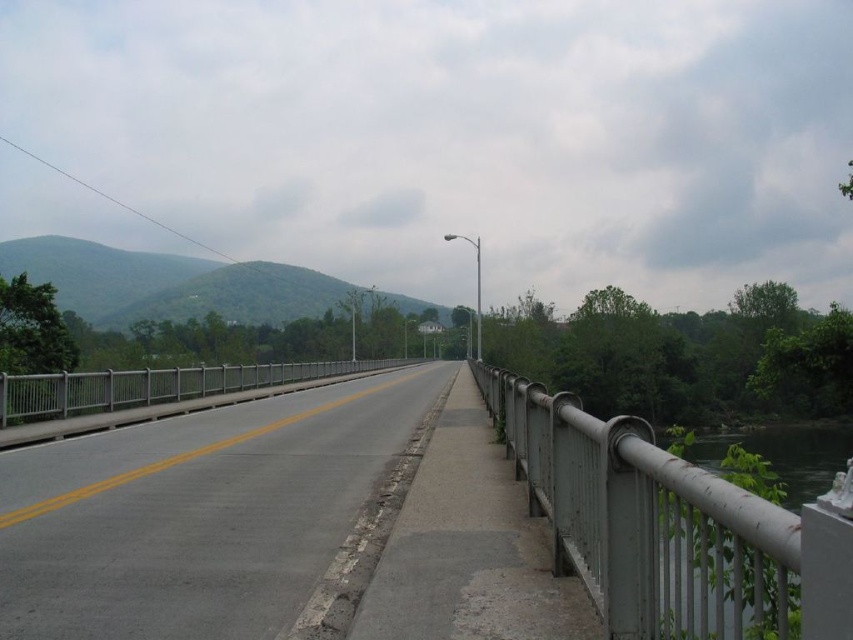
Who is positioned more to the left, green leafy mountain at upper left or green metallic railing at right?

green leafy mountain at upper left is more to the left.

What do you see at coordinates (167, 284) in the screenshot? The height and width of the screenshot is (640, 853). I see `green leafy mountain at upper left` at bounding box center [167, 284].

At what (x,y) coordinates should I click in order to perform the action: click on green leafy mountain at upper left. Please return your answer as a coordinate pair (x, y). Looking at the image, I should click on (167, 284).

Based on the photo, can you confirm if metallic gray railing at right is positioned to the right of green metallic railing at right?

Incorrect, metallic gray railing at right is not on the right side of green metallic railing at right.

This screenshot has width=853, height=640. Describe the element at coordinates (647, 522) in the screenshot. I see `metallic gray railing at right` at that location.

Locate an element on the screen. The height and width of the screenshot is (640, 853). metallic gray railing at right is located at coordinates (647, 522).

Can you confirm if metallic gray railing at right is shorter than green leafy mountain at upper left?

Correct, metallic gray railing at right is not as tall as green leafy mountain at upper left.

In order to click on metallic gray railing at right in this screenshot , I will do `click(647, 522)`.